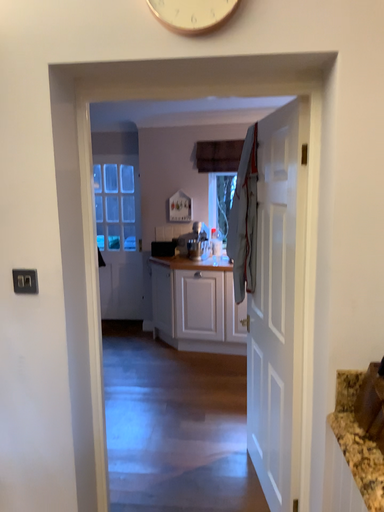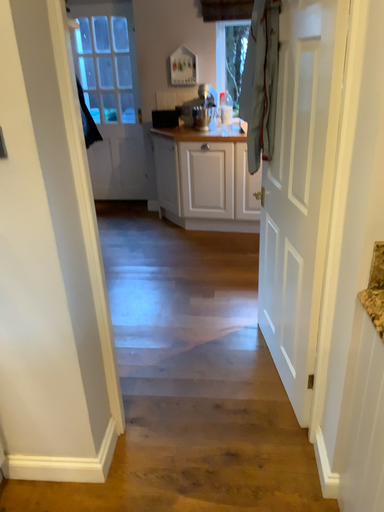
Question: Which way did the camera rotate in the video?

Choices:
 (A) rotated upward
 (B) rotated downward

Answer: (B)